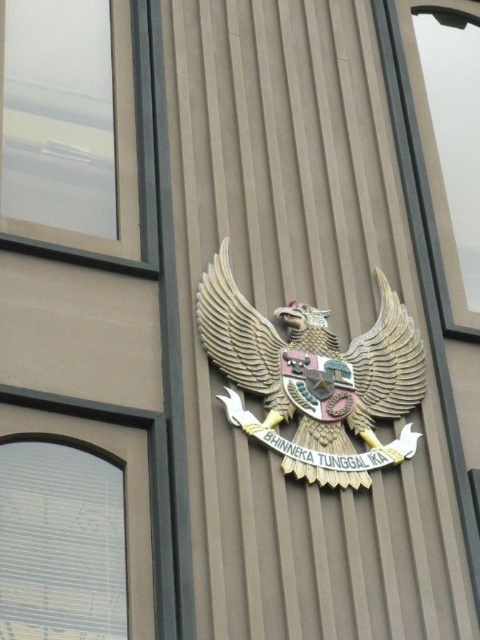
Question: Among these objects, which one is farthest from the camera?

Choices:
 (A) wooden eagle at center
 (B) clear glass window at upper left
 (C) transparent glass window at upper right

Answer: (C)

Question: Estimate the real-world distances between objects in this image. Which object is closer to the clear glass window at upper left?

Choices:
 (A) transparent glass window at upper right
 (B) wooden eagle at center

Answer: (B)

Question: Which of the following is the farthest from the observer?

Choices:
 (A) coord(157,216)
 (B) coord(402,64)

Answer: (B)

Question: Where is transparent glass window at upper right located in relation to clear glass window at upper left in the image?

Choices:
 (A) above
 (B) below

Answer: (B)

Question: Is wooden eagle at center positioned at the back of clear glass window at upper left?

Choices:
 (A) no
 (B) yes

Answer: (A)

Question: Does wooden eagle at center appear over clear glass window at upper left?

Choices:
 (A) no
 (B) yes

Answer: (A)